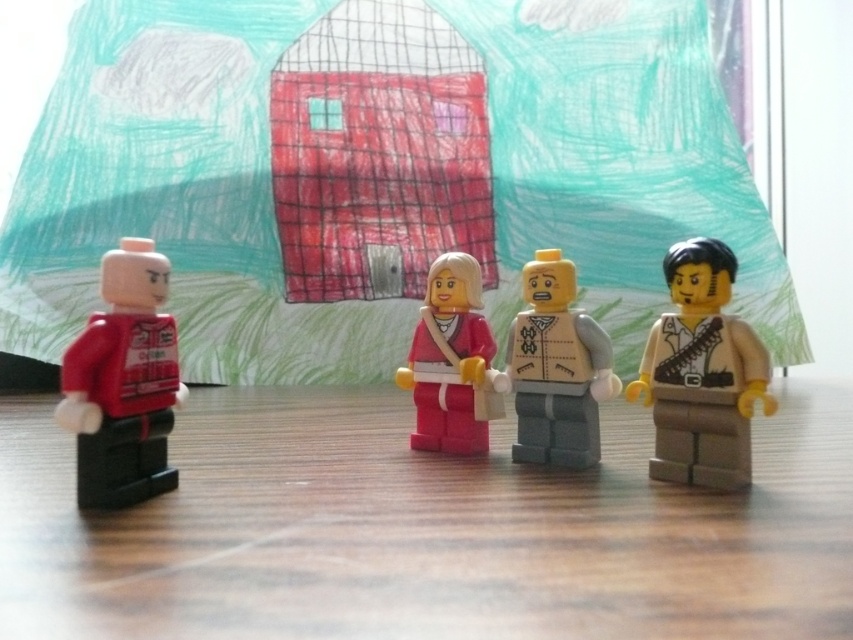
Can you confirm if wooden table at center is positioned to the right of light gray plastic figure at center?

In fact, wooden table at center is to the left of light gray plastic figure at center.

Does point (845, 422) come in front of point (512, 339)?

No.

Who is more distant from viewer, (x=448, y=508) or (x=550, y=419)?

Point (x=550, y=419)

You are a GUI agent. You are given a task and a screenshot of the screen. Output one action in this format:
    pyautogui.click(x=<x>, y=<y>)
    Task: Click on the wooden table at center
    This screenshot has width=853, height=640.
    Given the screenshot: What is the action you would take?
    pyautogui.click(x=425, y=529)

Is matte red shirt at left below light gray plastic figure at center?

Yes, matte red shirt at left is below light gray plastic figure at center.

Between matte red shirt at left and light gray plastic figure at center, which one appears on the right side from the viewer's perspective?

Positioned to the right is light gray plastic figure at center.

Which is in front, point (131, 422) or point (577, 371)?

Point (131, 422) is in front.

Locate an element on the screen. Image resolution: width=853 pixels, height=640 pixels. matte red shirt at left is located at coordinates (123, 381).

Between matte red shirt at left and tan matte minifigure at right, which one appears on the left side from the viewer's perspective?

matte red shirt at left

Which is behind, point (136, 493) or point (747, 385)?

Positioned behind is point (747, 385).

This screenshot has width=853, height=640. What are the coordinates of `matte red shirt at left` in the screenshot? It's located at (123, 381).